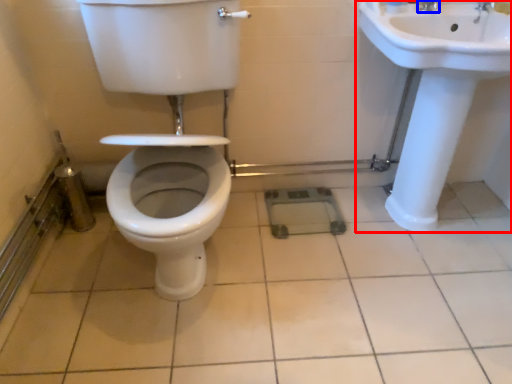
Question: Which object appears closest to the camera in this image, sink (highlighted by a red box) or tap (highlighted by a blue box)?

Choices:
 (A) sink
 (B) tap

Answer: (A)